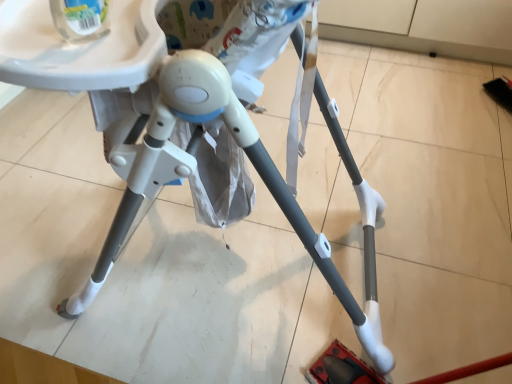
You are a GUI agent. You are given a task and a screenshot of the screen. Output one action in this format:
    pyautogui.click(x=<x>, y=<y>)
    Task: Click on the vacant space situated on the left part of white plastic tripod at center
    This screenshot has height=384, width=512.
    Given the screenshot: What is the action you would take?
    pyautogui.click(x=53, y=221)